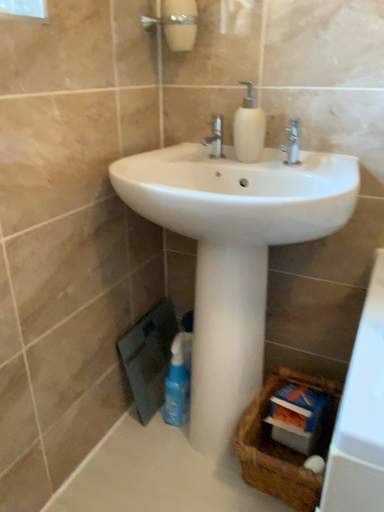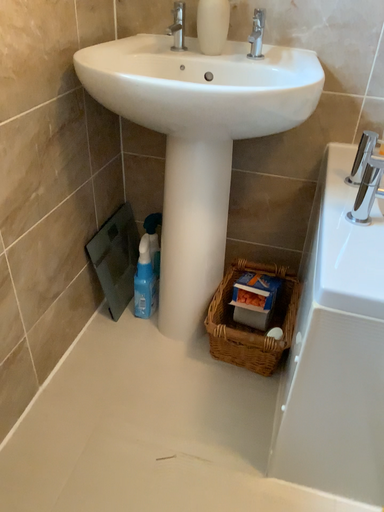
Question: How did the camera likely rotate when shooting the video?

Choices:
 (A) rotated left
 (B) rotated right

Answer: (B)